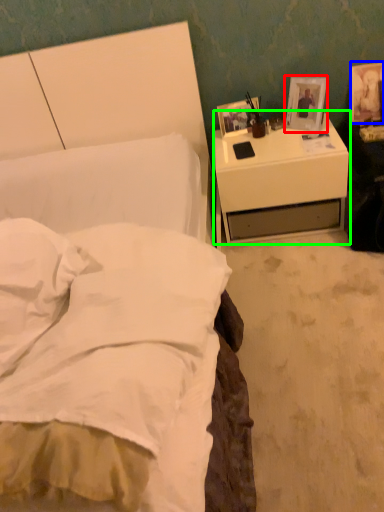
Question: Which object is positioned closest to picture frame (highlighted by a red box)? Select from picture frame (highlighted by a blue box) and nightstand (highlighted by a green box).

Choices:
 (A) picture frame
 (B) nightstand

Answer: (B)